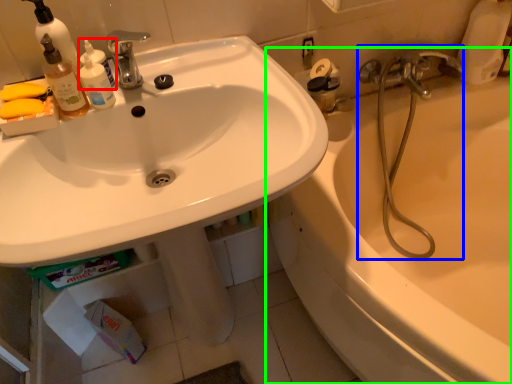
Question: Which object is positioned closest to cleaning product (highlighted by a red box)? Select from plumbing fixture (highlighted by a blue box) and bathtub (highlighted by a green box).

Choices:
 (A) plumbing fixture
 (B) bathtub

Answer: (A)